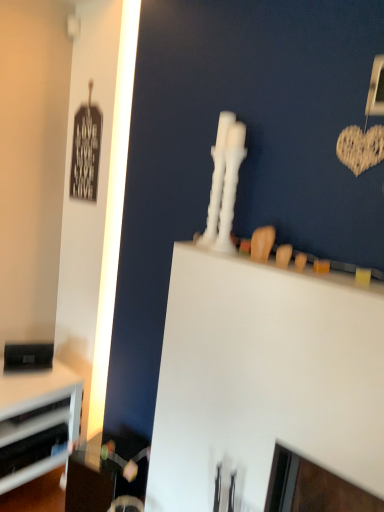
Question: From the image's perspective, is black matte speaker at lower left located above or below white plastic drawer at lower left, positioned as the first drawer in bottom-to-top order?

Choices:
 (A) below
 (B) above

Answer: (B)

Question: Looking at the image, does black matte speaker at lower left seem bigger or smaller compared to white plastic drawer at lower left, positioned as the first drawer in bottom-to-top order?

Choices:
 (A) big
 (B) small

Answer: (B)

Question: Which object is positioned closest to the black matte speaker at lower left?

Choices:
 (A) white matte computer desk at upper center
 (B) white plastic drawer at lower left, the 2th drawer positioned from the top
 (C) brushed metal drawer at lower left, the 1th drawer in the top-to-bottom sequence

Answer: (C)

Question: Considering the real-world distances, which object is farthest from the white matte computer desk at upper center?

Choices:
 (A) white plastic drawer at lower left, positioned as the first drawer in bottom-to-top order
 (B) brushed metal drawer at lower left, the 1th drawer in the top-to-bottom sequence
 (C) black matte speaker at lower left

Answer: (C)